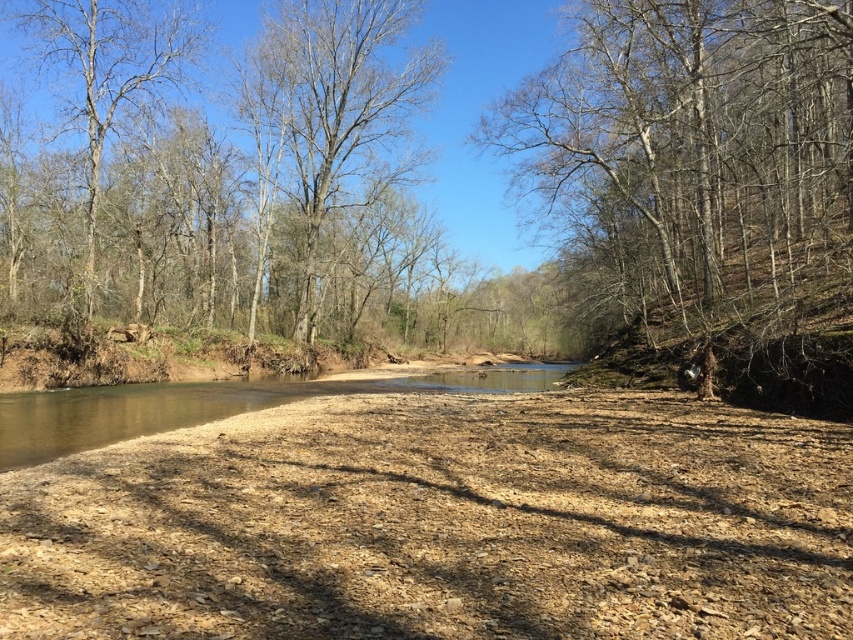
Question: Which object appears farthest from the camera in this image?

Choices:
 (A) brown sandy river at center
 (B) bare branches at left

Answer: (B)

Question: Which object is positioned farthest from the bare branches at left?

Choices:
 (A) bare wood tree at center
 (B) bare branches at upper right

Answer: (B)

Question: Is bare branches at upper right thinner than bare wood tree at center?

Choices:
 (A) yes
 (B) no

Answer: (A)

Question: Does bare wood tree at center come in front of bare branches at left?

Choices:
 (A) yes
 (B) no

Answer: (B)

Question: Considering the relative positions of bare branches at upper right and bare wood tree at center in the image provided, where is bare branches at upper right located with respect to bare wood tree at center?

Choices:
 (A) below
 (B) above

Answer: (A)

Question: Among these objects, which one is farthest from the camera?

Choices:
 (A) brown sandy river at center
 (B) bare wood tree at center
 (C) bare branches at left
 (D) bare branches at upper right

Answer: (B)